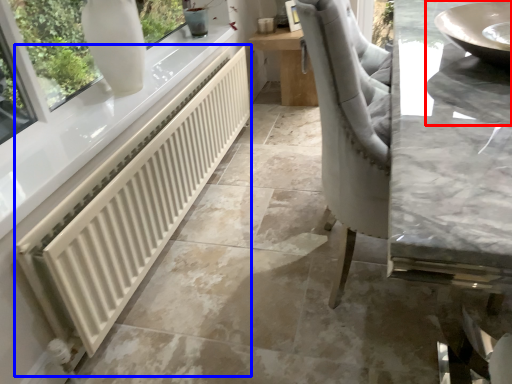
Question: Which object appears closest to the camera in this image, sink (highlighted by a red box) or radiator (highlighted by a blue box)?

Choices:
 (A) sink
 (B) radiator

Answer: (A)